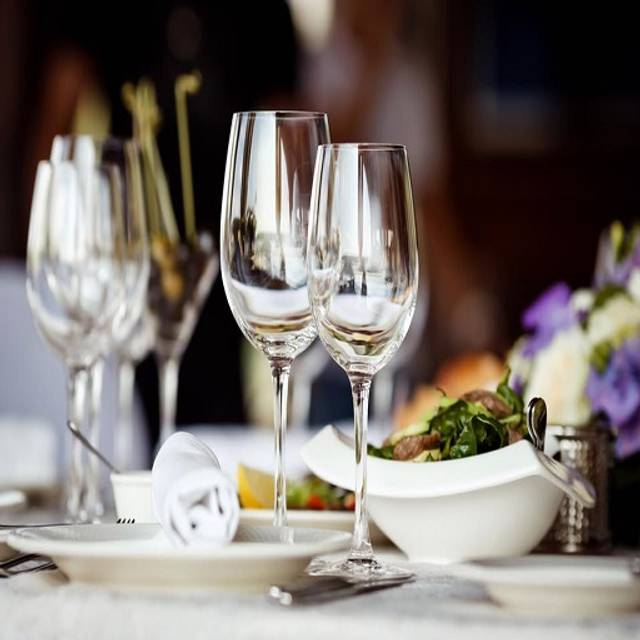
I want to click on table, so click(145, 605).